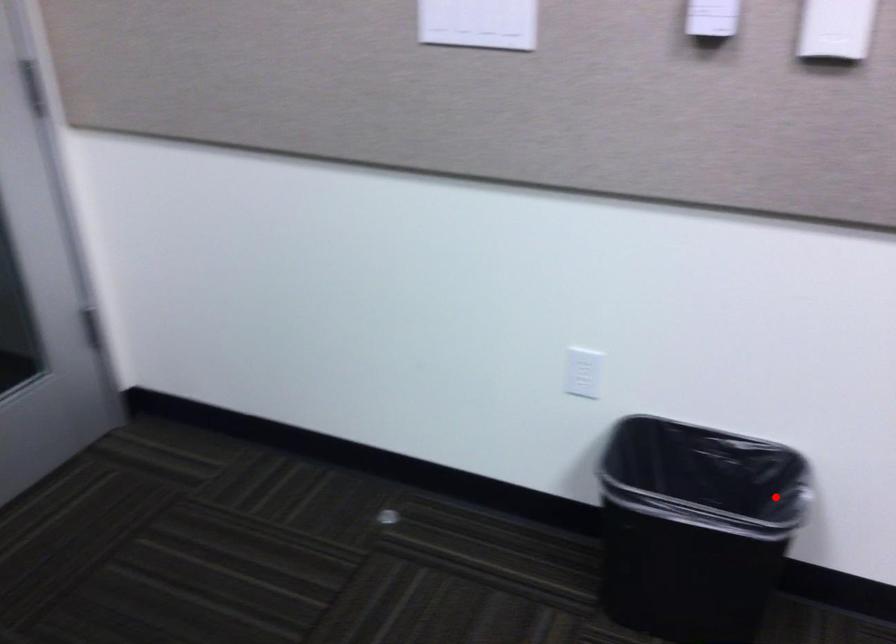
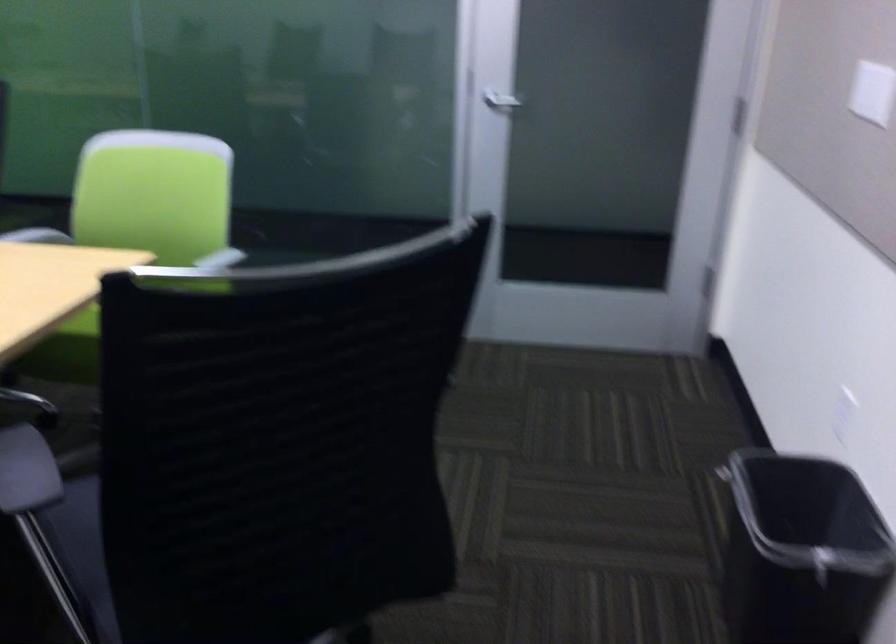
Where in the second image is the point corresponding to the highlighted location from the first image?

(800, 552)